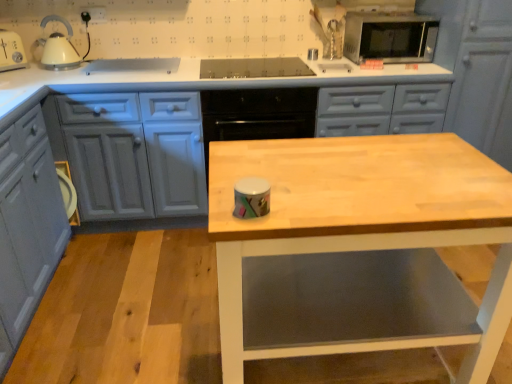
Question: Is matte gray cabinet at upper right, placed as the 1th cabinetry when sorted from right to left, thinner than wooden table at center?

Choices:
 (A) no
 (B) yes

Answer: (B)

Question: Is matte gray cabinet at upper right, placed as the 1th cabinetry when sorted from right to left, positioned in front of wooden table at center?

Choices:
 (A) yes
 (B) no

Answer: (B)

Question: From a real-world perspective, is matte gray cabinet at upper right, which appears as the 3th cabinetry when viewed from the left, under wooden table at center?

Choices:
 (A) yes
 (B) no

Answer: (B)

Question: From the image's perspective, would you say matte gray cabinet at upper right, placed as the 1th cabinetry when sorted from right to left, is shown under wooden table at center?

Choices:
 (A) no
 (B) yes

Answer: (A)

Question: Is matte gray cabinet at upper right, placed as the 1th cabinetry when sorted from right to left, facing towards wooden table at center?

Choices:
 (A) no
 (B) yes

Answer: (A)

Question: From a real-world perspective, relative to matte gray cabinet at lower left, the third cabinetry viewed from the right, is matte gray cabinet at upper right, placed as the 1th cabinetry when sorted from right to left, vertically above or below?

Choices:
 (A) above
 (B) below

Answer: (A)

Question: Considering the positions of matte gray cabinet at upper right, placed as the 1th cabinetry when sorted from right to left, and matte gray cabinet at lower left, the 1th cabinetry from the left, in the image, is matte gray cabinet at upper right, placed as the 1th cabinetry when sorted from right to left, taller or shorter than matte gray cabinet at lower left, the 1th cabinetry from the left,?

Choices:
 (A) short
 (B) tall

Answer: (B)

Question: Considering their positions, is matte gray cabinet at upper right, placed as the 1th cabinetry when sorted from right to left, located in front of or behind matte gray cabinet at lower left, the 1th cabinetry from the left?

Choices:
 (A) behind
 (B) front

Answer: (A)

Question: Considering the relative positions of matte gray cabinet at upper right, placed as the 1th cabinetry when sorted from right to left, and matte gray cabinet at lower left, the 1th cabinetry from the left, in the image provided, is matte gray cabinet at upper right, placed as the 1th cabinetry when sorted from right to left, to the left or to the right of matte gray cabinet at lower left, the 1th cabinetry from the left,?

Choices:
 (A) left
 (B) right

Answer: (B)

Question: Would you say wooden table at center is to the left or to the right of matte gray cabinet at upper right, placed as the 1th cabinetry when sorted from right to left, in the picture?

Choices:
 (A) right
 (B) left

Answer: (B)

Question: Is wooden table at center taller or shorter than matte gray cabinet at upper right, which appears as the 3th cabinetry when viewed from the left?

Choices:
 (A) tall
 (B) short

Answer: (B)

Question: Based on their sizes in the image, would you say wooden table at center is bigger or smaller than matte gray cabinet at upper right, which appears as the 3th cabinetry when viewed from the left?

Choices:
 (A) big
 (B) small

Answer: (A)

Question: Is wooden table at center in front of or behind matte gray cabinet at upper right, placed as the 1th cabinetry when sorted from right to left, in the image?

Choices:
 (A) front
 (B) behind

Answer: (A)

Question: From a real-world perspective, is matte gray cabinets at center, the second cabinetry when ordered from left to right, positioned above or below matte gray cabinet at upper right, which appears as the 3th cabinetry when viewed from the left?

Choices:
 (A) below
 (B) above

Answer: (A)

Question: Is matte gray cabinets at center, the second cabinetry when ordered from right to left, inside the boundaries of matte gray cabinet at upper right, which appears as the 3th cabinetry when viewed from the left, or outside?

Choices:
 (A) inside
 (B) outside

Answer: (B)